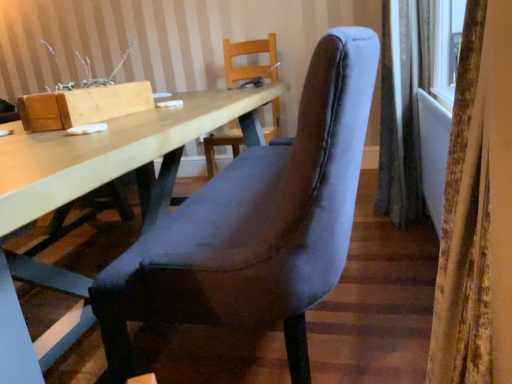
This screenshot has height=384, width=512. Identify the location of gray fabric curtain at right, the second curtain from the front. (400, 116).

What do you see at coordinates (116, 152) in the screenshot? I see `light wood table at center` at bounding box center [116, 152].

Find the location of `velvet grey chair at center`. velvet grey chair at center is located at coordinates (256, 223).

Does gray fabric curtain at right, arranged as the first curtain when viewed from the right, have a larger size compared to velvet grey chair at center?

Incorrect, gray fabric curtain at right, arranged as the first curtain when viewed from the right, is not larger than velvet grey chair at center.

Is gray fabric curtain at right, which ranks as the 2th curtain in left-to-right order, positioned before velvet grey chair at center?

No, gray fabric curtain at right, which ranks as the 2th curtain in left-to-right order, is further to the viewer.

Is point (384, 33) closer to camera compared to point (149, 299)?

No, it is not.

Would you say gray fabric curtain at right, which ranks as the 2th curtain in left-to-right order, contains velvet grey chair at center?

No, velvet grey chair at center is located outside of gray fabric curtain at right, which ranks as the 2th curtain in left-to-right order.

Considering the positions of objects velvet curtain at right, the 1th curtain viewed from the front, and velvet grey chair at center in the image provided, who is more to the right, velvet curtain at right, the 1th curtain viewed from the front, or velvet grey chair at center?

Positioned to the right is velvet curtain at right, the 1th curtain viewed from the front.

Can you see velvet curtain at right, which is the 1th curtain from left to right, touching velvet grey chair at center?

No, velvet curtain at right, which is the 1th curtain from left to right, is not making contact with velvet grey chair at center.

Which is less distant, [463,172] or [323,202]?

Point [463,172].

Between velvet curtain at right, positioned as the 2th curtain in back-to-front order, and velvet grey chair at center, which one has less height?

With less height is velvet curtain at right, positioned as the 2th curtain in back-to-front order.

Between velvet curtain at right, the 1th curtain viewed from the front, and light wood table at center, which one is positioned behind?

light wood table at center is behind.

Who is shorter, velvet curtain at right, the 2th curtain in the right-to-left sequence, or light wood table at center?

light wood table at center.

Considering the positions of objects velvet curtain at right, the 1th curtain viewed from the front, and light wood table at center in the image provided, who is more to the right, velvet curtain at right, the 1th curtain viewed from the front, or light wood table at center?

Positioned to the right is velvet curtain at right, the 1th curtain viewed from the front.

Can you confirm if velvet curtain at right, the 1th curtain viewed from the front, is smaller than gray fabric curtain at right, the second curtain from the front?

Indeed, velvet curtain at right, the 1th curtain viewed from the front, has a smaller size compared to gray fabric curtain at right, the second curtain from the front.

Between velvet curtain at right, the 2th curtain in the right-to-left sequence, and gray fabric curtain at right, which ranks as the 2th curtain in left-to-right order, which one has less height?

velvet curtain at right, the 2th curtain in the right-to-left sequence.

Which object is closer to the camera taking this photo, velvet curtain at right, which is the 1th curtain from left to right, or gray fabric curtain at right, arranged as the first curtain when viewed from the right?

Positioned in front is velvet curtain at right, which is the 1th curtain from left to right.

Where is `curtain above the velvet curtain at right, which is the 1th curtain from left to right (from the image's perspective)`? This screenshot has width=512, height=384. curtain above the velvet curtain at right, which is the 1th curtain from left to right (from the image's perspective) is located at coordinates (400, 116).

Which of these two, gray fabric curtain at right, which ranks as the 2th curtain in left-to-right order, or light wood table at center, stands taller?

gray fabric curtain at right, which ranks as the 2th curtain in left-to-right order, is taller.

Can you confirm if gray fabric curtain at right, the second curtain from the front, is smaller than light wood table at center?

Correct, gray fabric curtain at right, the second curtain from the front, occupies less space than light wood table at center.

Is point (402, 14) positioned behind point (3, 317)?

Yes, point (402, 14) is farther from viewer.

Is gray fabric curtain at right, which ranks as the 2th curtain in left-to-right order, outside of light wood table at center?

gray fabric curtain at right, which ranks as the 2th curtain in left-to-right order, is positioned outside light wood table at center.

From a real-world perspective, is light wood table at center located beneath gray fabric curtain at right, which ranks as the 2th curtain in left-to-right order?

Yes, from a real-world perspective, light wood table at center is beneath gray fabric curtain at right, which ranks as the 2th curtain in left-to-right order.

Looking at this image, from the image's perspective, between light wood table at center and gray fabric curtain at right, which ranks as the 2th curtain in left-to-right order, who is located below?

light wood table at center appears lower in the image.

Identify the location of curtain behind the light wood table at center. The height and width of the screenshot is (384, 512). (400, 116).

Between light wood table at center and gray fabric curtain at right, arranged as the first curtain when viewed from the right, which one appears on the right side from the viewer's perspective?

Positioned to the right is gray fabric curtain at right, arranged as the first curtain when viewed from the right.

Considering the sizes of objects light wood table at center and velvet curtain at right, which is the 1th curtain from left to right, in the image provided, who is taller, light wood table at center or velvet curtain at right, which is the 1th curtain from left to right,?

Standing taller between the two is velvet curtain at right, which is the 1th curtain from left to right.

Is light wood table at center in front of velvet curtain at right, positioned as the 2th curtain in back-to-front order?

No, light wood table at center is further to the viewer.

Looking at this image, is light wood table at center positioned with its back to velvet curtain at right, the 2th curtain in the right-to-left sequence?

Correct, light wood table at center is looking away from velvet curtain at right, the 2th curtain in the right-to-left sequence.

Is point (95, 153) closer or farther from the camera than point (500, 147)?

Point (95, 153).

The width and height of the screenshot is (512, 384). I want to click on curtain that is above the velvet grey chair at center (from the image's perspective), so click(x=400, y=116).

In order to click on chair below the velvet curtain at right, positioned as the 2th curtain in back-to-front order (from a real-world perspective) in this screenshot , I will do `click(256, 223)`.

From the image, which object appears to be farther from gray fabric curtain at right, the 1th curtain from the back, velvet grey chair at center or light wood table at center?

Based on the image, velvet grey chair at center appears to be further to gray fabric curtain at right, the 1th curtain from the back.

Based on the photo, when comparing their distances from velvet curtain at right, which is the 1th curtain from left to right, does velvet grey chair at center or gray fabric curtain at right, the second curtain from the front, seem further?

gray fabric curtain at right, the second curtain from the front, is further to velvet curtain at right, which is the 1th curtain from left to right.

Looking at the image, which one is located closer to velvet curtain at right, positioned as the 2th curtain in back-to-front order, velvet grey chair at center or light wood table at center?

Based on the image, velvet grey chair at center appears to be nearer to velvet curtain at right, positioned as the 2th curtain in back-to-front order.

Considering their positions, is gray fabric curtain at right, which ranks as the 2th curtain in left-to-right order, positioned closer to light wood table at center than velvet curtain at right, the 1th curtain viewed from the front?

Among the two, velvet curtain at right, the 1th curtain viewed from the front, is located nearer to light wood table at center.

When comparing their distances from light wood table at center, does velvet curtain at right, the 1th curtain viewed from the front, or velvet grey chair at center seem further?

The object further to light wood table at center is velvet curtain at right, the 1th curtain viewed from the front.

Which object lies nearer to the anchor point velvet grey chair at center, gray fabric curtain at right, arranged as the first curtain when viewed from the right, or velvet curtain at right, the 2th curtain in the right-to-left sequence?

velvet curtain at right, the 2th curtain in the right-to-left sequence.

From the picture: Looking at the image, which one is located closer to velvet grey chair at center, velvet curtain at right, the 2th curtain in the right-to-left sequence, or light wood table at center?

light wood table at center lies closer to velvet grey chair at center than the other object.

Estimate the real-world distances between objects in this image. Which object is further from gray fabric curtain at right, arranged as the first curtain when viewed from the right, light wood table at center or velvet grey chair at center?

velvet grey chair at center is further to gray fabric curtain at right, arranged as the first curtain when viewed from the right.

This screenshot has height=384, width=512. In order to click on chair located between light wood table at center and gray fabric curtain at right, the 1th curtain from the back, in the depth direction in this screenshot , I will do `click(256, 223)`.

Identify the location of chair between velvet curtain at right, positioned as the 2th curtain in back-to-front order, and gray fabric curtain at right, which ranks as the 2th curtain in left-to-right order, along the z-axis. (256, 223).

The height and width of the screenshot is (384, 512). In order to click on table between velvet curtain at right, the 2th curtain in the right-to-left sequence, and gray fabric curtain at right, the 1th curtain from the back, along the z-axis in this screenshot , I will do `click(116, 152)`.

Identify the location of chair between light wood table at center and velvet curtain at right, the 2th curtain in the right-to-left sequence, in the horizontal direction. This screenshot has width=512, height=384. (256, 223).